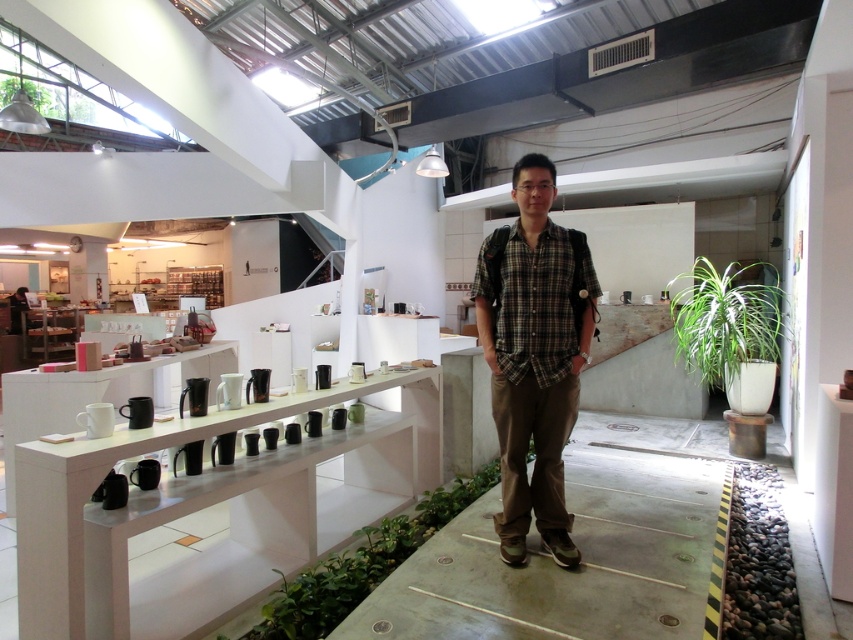
You are a store employee who needs to place a new sign on the wall. The sign must be placed at a height that is between the height of the plaid cotton shirt at center and the green leafy plant at right. Where should you place the sign?

The plaid cotton shirt at center is taller than the green leafy plant at right. Therefore, the sign should be placed between the height of the green leafy plant at right and the plaid cotton shirt at center, ensuring it is higher than the plant but lower than the shirt.

You are standing in the retail space and notice a plaid cotton shirt at center and a green leafy plant at right. Which object is positioned to the left of the other?

The plaid cotton shirt at center is to the left of the green leafy plant at right.